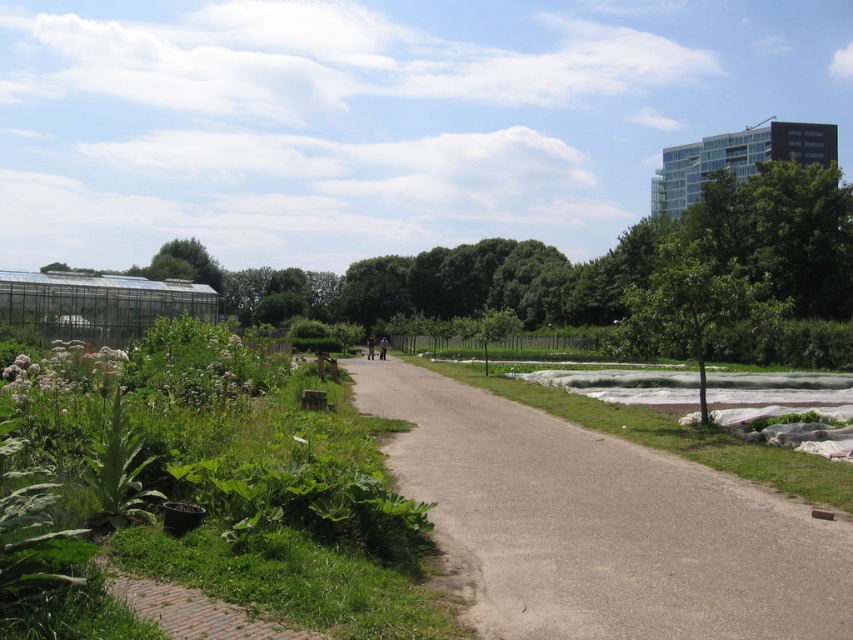
Which is below, gray asphalt path at center or green leafy tree at center-right?

Positioned lower is gray asphalt path at center.

Is gray asphalt path at center taller than green leafy tree at center-right?

No.

You are a GUI agent. You are given a task and a screenshot of the screen. Output one action in this format:
    pyautogui.click(x=<x>, y=<y>)
    Task: Click on the gray asphalt path at center
    This screenshot has height=640, width=853.
    Given the screenshot: What is the action you would take?
    pyautogui.click(x=601, y=525)

In order to click on gray asphalt path at center in this screenshot , I will do `click(601, 525)`.

Is green leafy plants at left to the left of gray asphalt path at center from the viewer's perspective?

Indeed, green leafy plants at left is positioned on the left side of gray asphalt path at center.

Is point (103, 499) farther from camera compared to point (624, 456)?

No.

You are a GUI agent. You are given a task and a screenshot of the screen. Output one action in this format:
    pyautogui.click(x=<x>, y=<y>)
    Task: Click on the green leafy plants at left
    This screenshot has height=640, width=853.
    Given the screenshot: What is the action you would take?
    pyautogui.click(x=231, y=481)

Can you confirm if green leafy plants at left is positioned to the right of green leafy tree at center-right?

Incorrect, green leafy plants at left is not on the right side of green leafy tree at center-right.

Is green leafy plants at left wider than green leafy tree at center-right?

No, green leafy plants at left is not wider than green leafy tree at center-right.

This screenshot has width=853, height=640. What are the coordinates of `green leafy plants at left` in the screenshot? It's located at (231, 481).

Locate an element on the screen. This screenshot has height=640, width=853. green leafy plants at left is located at coordinates (231, 481).